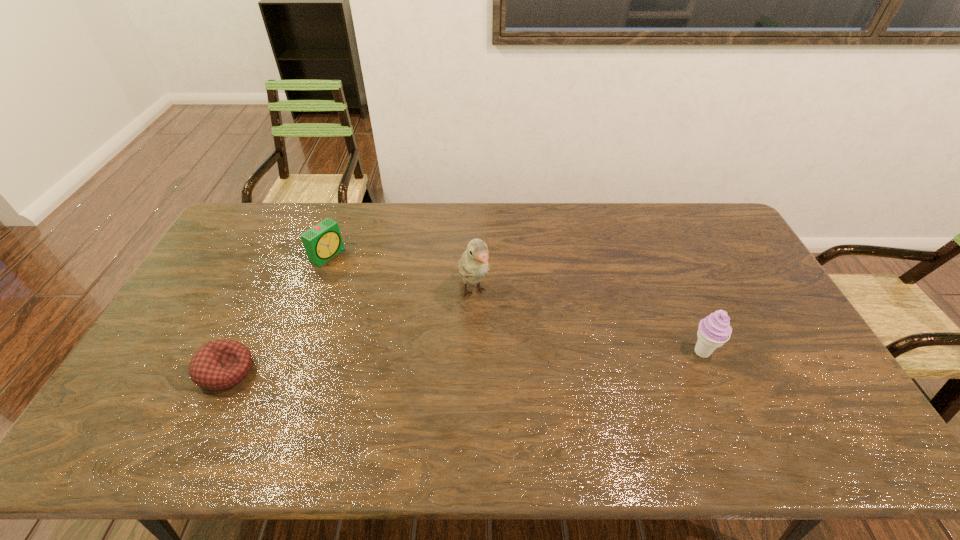
Image resolution: width=960 pixels, height=540 pixels. Find the location of `free space between the third tallest object and the leftmost object`. free space between the third tallest object and the leftmost object is located at coordinates (276, 313).

This screenshot has height=540, width=960. I want to click on empty location between the second farthest object and the second object from left to right, so click(400, 274).

Locate an element on the screen. The height and width of the screenshot is (540, 960). free area in between the icecream and the shortest object is located at coordinates (464, 362).

Image resolution: width=960 pixels, height=540 pixels. I want to click on object that ranks as the closest to the second shortest object, so click(220, 364).

The height and width of the screenshot is (540, 960). Find the location of `the third closest object to the second farthest object`. the third closest object to the second farthest object is located at coordinates point(714,330).

The image size is (960, 540). I want to click on vacant space that satisfies the following two spatial constraints: 1. on the back side of the second object from right to left; 2. on the right side of the shortest object, so click(264, 292).

Locate an element on the screen. Image resolution: width=960 pixels, height=540 pixels. vacant area that satisfies the following two spatial constraints: 1. on the front side of the third object from left to right; 2. on the left side of the alarm clock is located at coordinates (314, 292).

Identify the location of free space in the image that satisfies the following two spatial constraints: 1. on the front side of the rightmost object; 2. on the right side of the tallest object. (473, 352).

Where is `vacant area that satisfies the following two spatial constraints: 1. on the front side of the alarm clock; 2. on the left side of the bird`? vacant area that satisfies the following two spatial constraints: 1. on the front side of the alarm clock; 2. on the left side of the bird is located at coordinates (x=314, y=292).

Where is `blank area in the image that satisfies the following two spatial constraints: 1. on the back side of the shortest object; 2. on the right side of the tallest object`? This screenshot has height=540, width=960. blank area in the image that satisfies the following two spatial constraints: 1. on the back side of the shortest object; 2. on the right side of the tallest object is located at coordinates (264, 292).